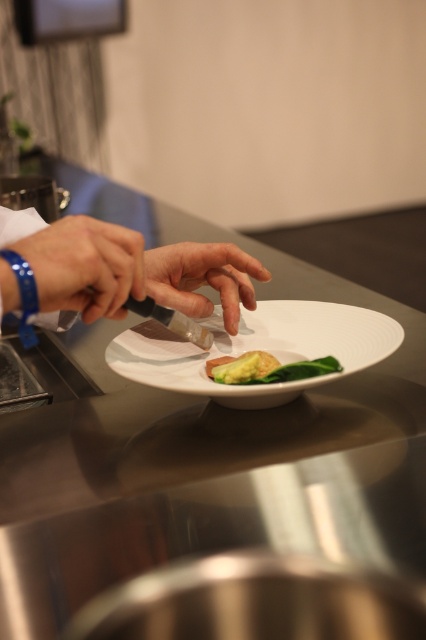
Which is behind, point (143, 280) or point (170, 257)?

The point (170, 257) is behind.

Is point (101, 225) positioned behind point (166, 301)?

No, (101, 225) is in front of (166, 301).

Is point (66, 262) positioned behind point (201, 310)?

That is False.

This screenshot has width=426, height=640. In order to click on blue rubber band at center in this screenshot , I will do `click(85, 266)`.

Which is behind, point (219, 289) or point (273, 368)?

Point (219, 289)

How far apart are matte white hand at center and green matte avocado at center?

They are 3.47 inches apart.

Which is in front, point (236, 304) or point (252, 380)?

Point (252, 380) is in front.

Locate an element on the screen. This screenshot has width=426, height=640. matte white hand at center is located at coordinates (203, 278).

Between white glossy plate at center and blue rubber band at center, which one is positioned lower?

Positioned lower is white glossy plate at center.

Is white glossy plate at center to the left of blue rubber band at center from the viewer's perspective?

Incorrect, white glossy plate at center is not on the left side of blue rubber band at center.

Find the location of a particular element. The height and width of the screenshot is (640, 426). white glossy plate at center is located at coordinates (258, 349).

Locate an element on the screen. The width and height of the screenshot is (426, 640). white glossy plate at center is located at coordinates (258, 349).